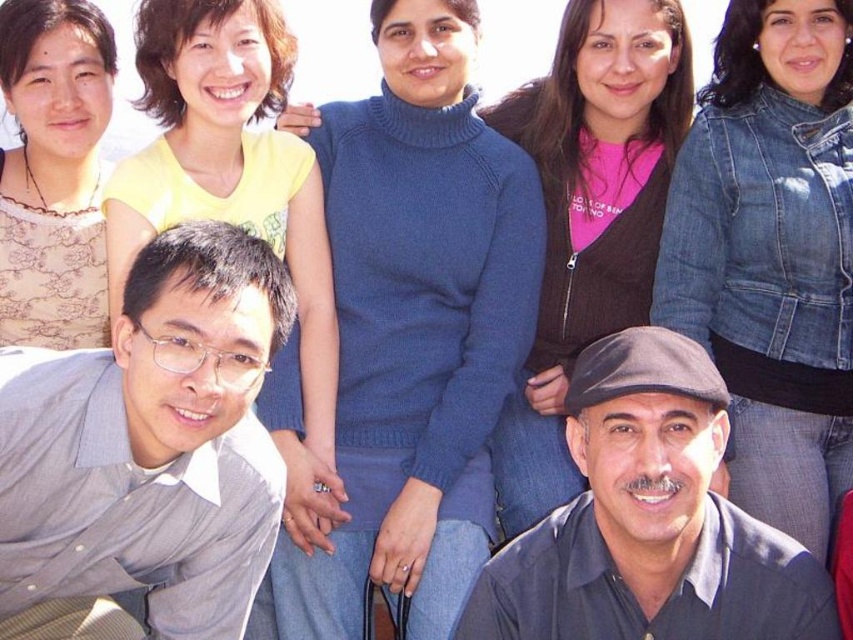
Who is higher up, gray shirt at lower left or dark gray fabric at lower right?

gray shirt at lower left is higher up.

Which is in front, point (209, 339) or point (587, 589)?

Positioned in front is point (209, 339).

Locate an element on the screen. The width and height of the screenshot is (853, 640). gray shirt at lower left is located at coordinates (151, 444).